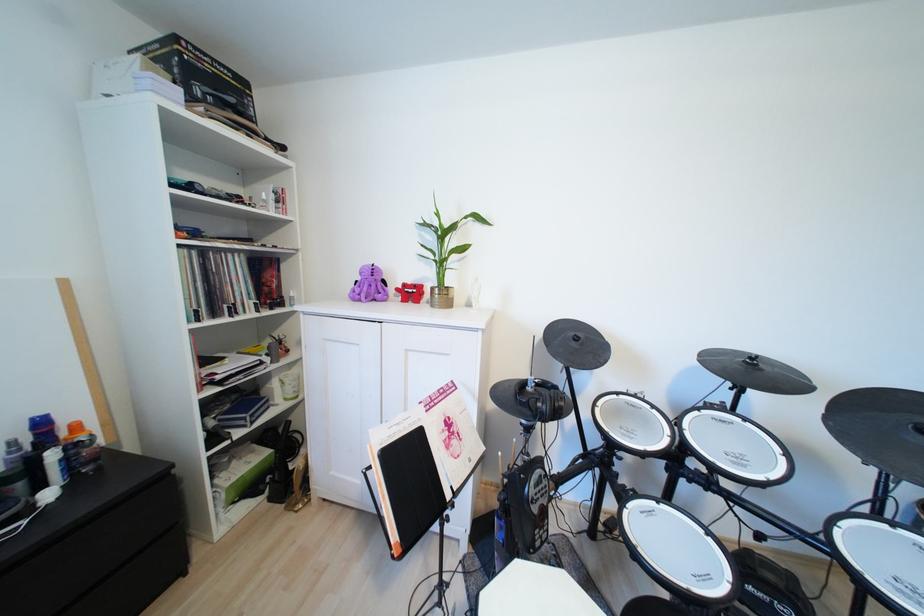
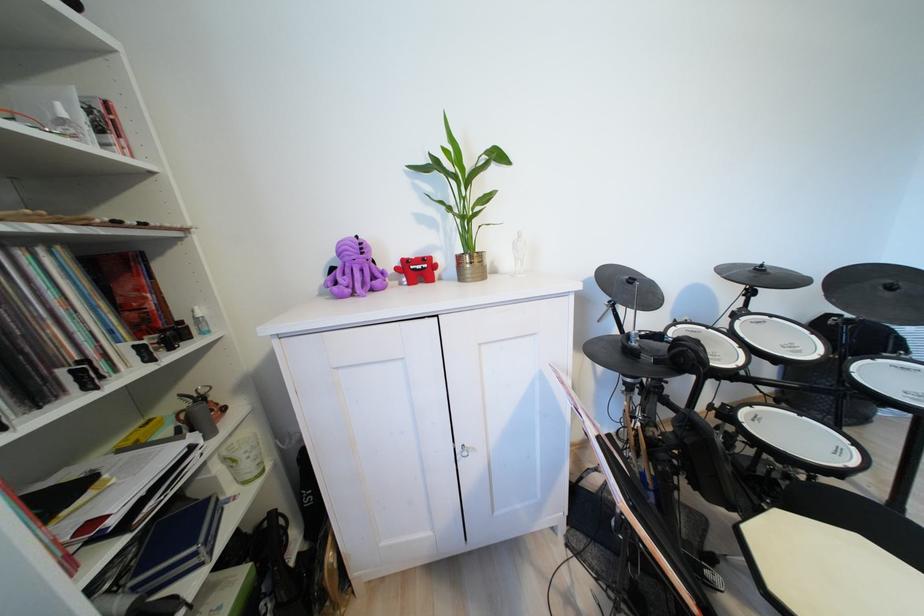
Question: The images are taken continuously from a first-person perspective. In which direction is your viewpoint rotating?

Choices:
 (A) Left
 (B) Right
 (C) Up
 (D) Down

Answer: (B)